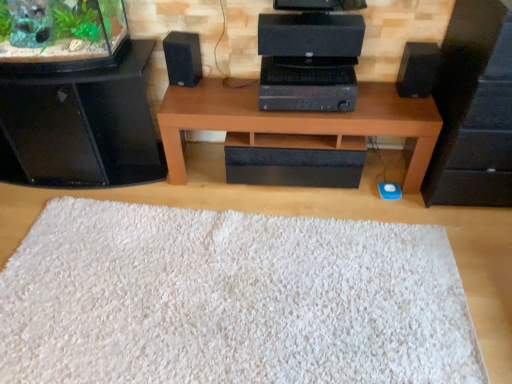
Question: From the image's perspective, is brown wood table at center beneath black matte speaker at left, the second speaker when ordered from right to left?

Choices:
 (A) yes
 (B) no

Answer: (A)

Question: Would you say brown wood table at center is outside black matte speaker at left, placed as the first speaker when sorted from left to right?

Choices:
 (A) yes
 (B) no

Answer: (A)

Question: Does brown wood table at center appear on the right side of black matte speaker at left, placed as the first speaker when sorted from left to right?

Choices:
 (A) no
 (B) yes

Answer: (B)

Question: Does brown wood table at center have a greater height compared to black matte speaker at left, placed as the first speaker when sorted from left to right?

Choices:
 (A) yes
 (B) no

Answer: (A)

Question: Is brown wood table at center touching black matte speaker at left, the second speaker when ordered from right to left?

Choices:
 (A) no
 (B) yes

Answer: (A)

Question: From their relative heights in the image, would you say green matte plant at upper left is taller or shorter than black matte speaker at left, the second speaker when ordered from right to left?

Choices:
 (A) short
 (B) tall

Answer: (B)

Question: Is point (11, 43) positioned closer to the camera than point (176, 82)?

Choices:
 (A) closer
 (B) farther

Answer: (A)

Question: Relative to black matte speaker at left, the second speaker when ordered from right to left, is green matte plant at upper left in front or behind?

Choices:
 (A) behind
 (B) front

Answer: (B)

Question: Considering the positions of green matte plant at upper left and black matte speaker at left, the second speaker when ordered from right to left, in the image, is green matte plant at upper left wider or thinner than black matte speaker at left, the second speaker when ordered from right to left,?

Choices:
 (A) wide
 (B) thin

Answer: (A)

Question: Based on their sizes in the image, would you say brown wood table at center is bigger or smaller than green matte plant at upper left?

Choices:
 (A) big
 (B) small

Answer: (A)

Question: In the image, is brown wood table at center on the left side or the right side of green matte plant at upper left?

Choices:
 (A) right
 (B) left

Answer: (A)

Question: From a real-world perspective, is brown wood table at center above or below green matte plant at upper left?

Choices:
 (A) above
 (B) below

Answer: (B)

Question: Is brown wood table at center taller or shorter than green matte plant at upper left?

Choices:
 (A) tall
 (B) short

Answer: (A)

Question: Considering the positions of black matte speaker at right, the second furniture from the left, and brown wood table at center in the image, is black matte speaker at right, the second furniture from the left, taller or shorter than brown wood table at center?

Choices:
 (A) tall
 (B) short

Answer: (A)

Question: Is point (464, 64) positioned closer to the camera than point (266, 114)?

Choices:
 (A) closer
 (B) farther

Answer: (A)